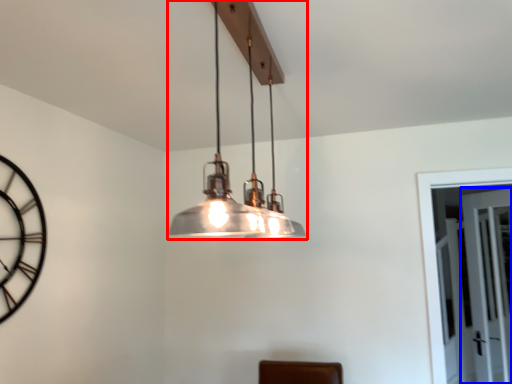
Question: Which object appears closest to the camera in this image, lamp (highlighted by a red box) or glass door (highlighted by a blue box)?

Choices:
 (A) lamp
 (B) glass door

Answer: (A)